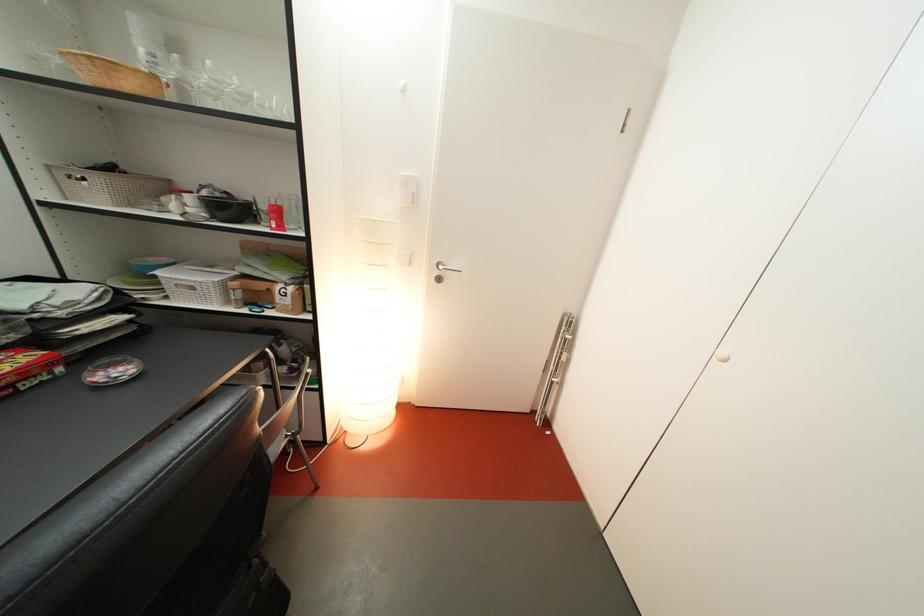
Describe the element at coordinates (444, 270) in the screenshot. I see `a silver door handle` at that location.